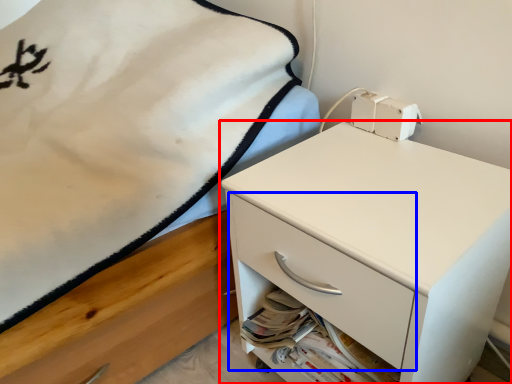
Question: Which of the following is the farthest to the observer, chest of drawers (highlighted by a red box) or drawer (highlighted by a blue box)?

Choices:
 (A) chest of drawers
 (B) drawer

Answer: (B)